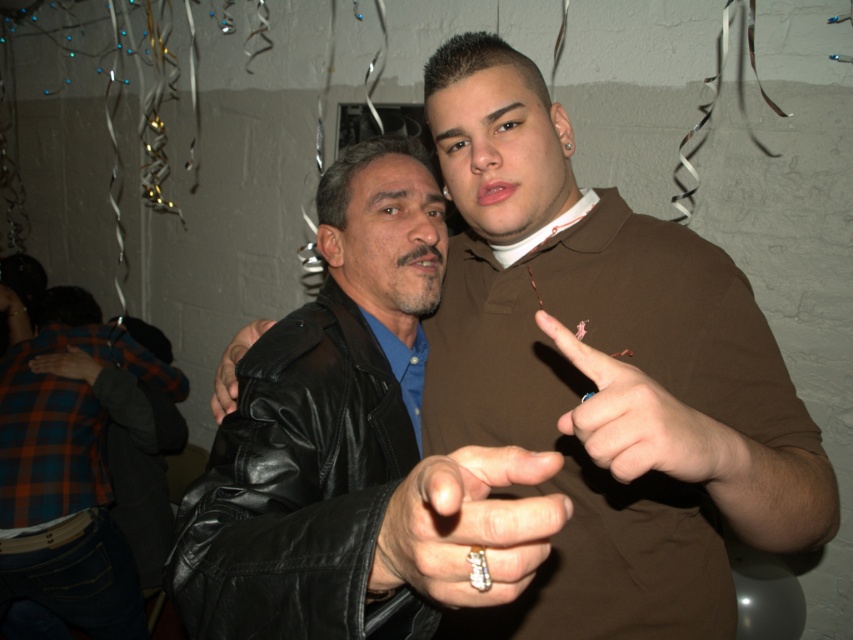
Which is more to the right, brown leather jacket at center or plaid fabric hand at lower left?

From the viewer's perspective, brown leather jacket at center appears more on the right side.

Is brown leather jacket at center thinner than plaid fabric hand at lower left?

No.

Is point (554, 131) positioned in front of point (71, 360)?

That is True.

This screenshot has width=853, height=640. What are the coordinates of `brown leather jacket at center` in the screenshot? It's located at (605, 372).

Can you confirm if gold metallic ring at center is wider than smooth brown leather hand at center?

In fact, gold metallic ring at center might be narrower than smooth brown leather hand at center.

Can you confirm if gold metallic ring at center is taller than smooth brown leather hand at center?

No.

Which is in front, point (428, 509) or point (579, 428)?

Point (428, 509) is in front.

Locate an element on the screen. This screenshot has width=853, height=640. gold metallic ring at center is located at coordinates (467, 525).

Is gold metallic ring at center bigger than plaid fabric hand at lower left?

Incorrect, gold metallic ring at center is not larger than plaid fabric hand at lower left.

Does gold metallic ring at center have a greater width compared to plaid fabric hand at lower left?

In fact, gold metallic ring at center might be narrower than plaid fabric hand at lower left.

Locate an element on the screen. gold metallic ring at center is located at coordinates (467, 525).